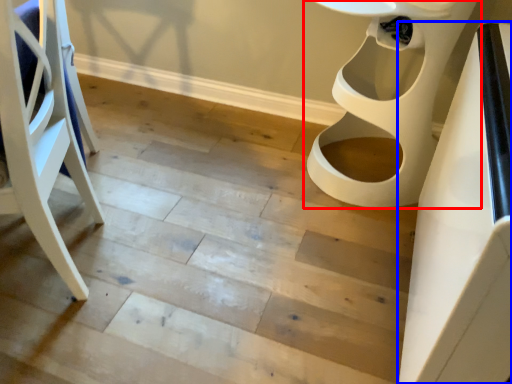
Question: Which object appears closest to the camera in this image, toilet (highlighted by a red box) or table (highlighted by a blue box)?

Choices:
 (A) toilet
 (B) table

Answer: (B)